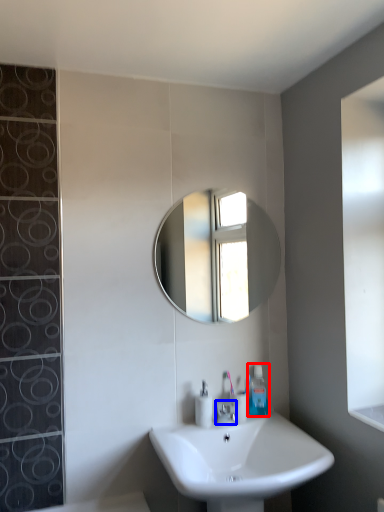
Question: Which object appears closest to the camera in this image, toiletry (highlighted by a red box) or tap (highlighted by a blue box)?

Choices:
 (A) toiletry
 (B) tap

Answer: (B)